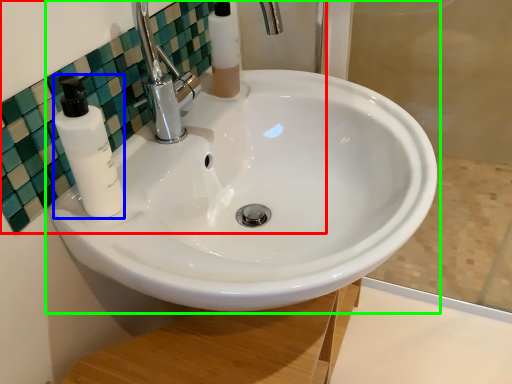
Question: Considering the real-world distances, which object is closest to mirror (highlighted by a red box)? soap dispenser (highlighted by a blue box) or sink (highlighted by a green box).

Choices:
 (A) soap dispenser
 (B) sink

Answer: (A)